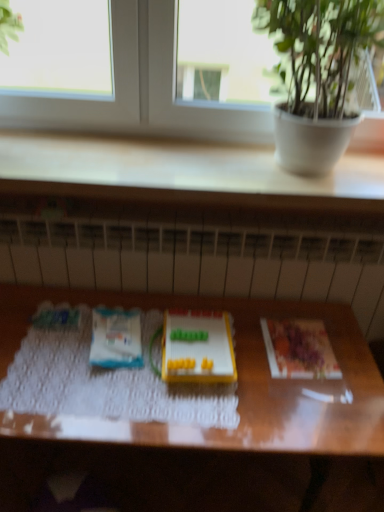
At what (x,y) coordinates should I click in order to perform the action: click on vacant space situated above printed paper at right, which appears as the first paperback book when viewed from the right (from a real-world perspective). Please return your answer as a coordinate pair (x, y). The width and height of the screenshot is (384, 512). Looking at the image, I should click on (296, 342).